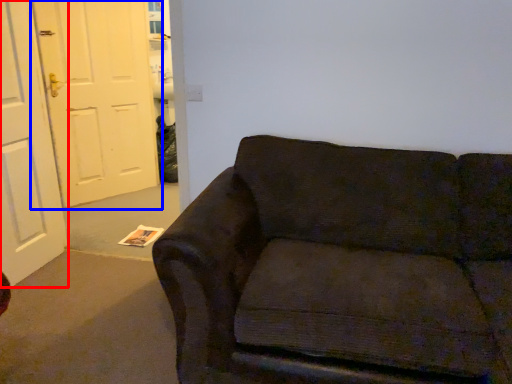
Question: Which point is further to the camera, door (highlighted by a red box) or door (highlighted by a blue box)?

Choices:
 (A) door
 (B) door

Answer: (B)